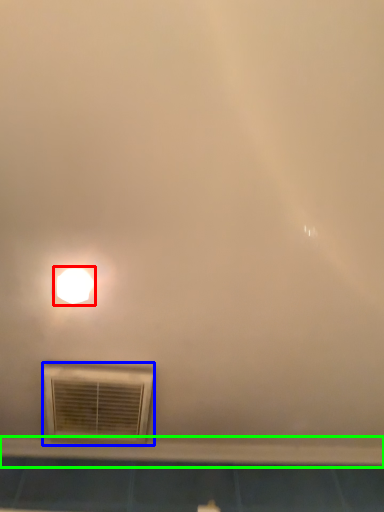
Question: Considering the real-world distances, which object is farthest from lamp (highlighted by a red box)? air conditioning (highlighted by a blue box) or window sill (highlighted by a green box)?

Choices:
 (A) air conditioning
 (B) window sill

Answer: (B)